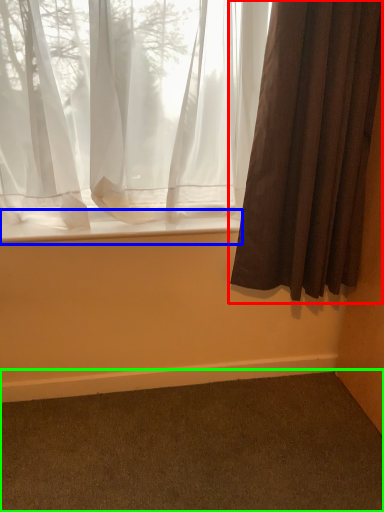
Question: Which is nearer to the curtain (highlighted by a red box)? window sill (highlighted by a blue box) or plain (highlighted by a green box).

Choices:
 (A) window sill
 (B) plain

Answer: (A)